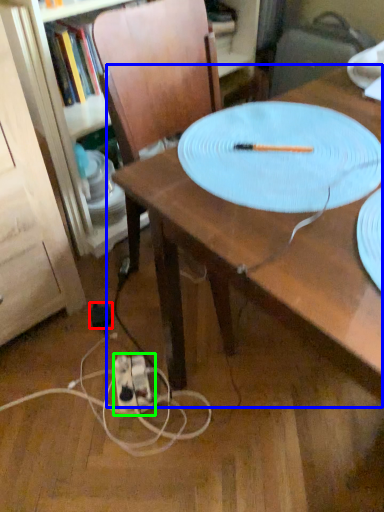
Question: Which object is positioned closest to electric outlet (highlighted by a red box)? Select from table (highlighted by a blue box) and extension cord (highlighted by a green box).

Choices:
 (A) table
 (B) extension cord

Answer: (B)